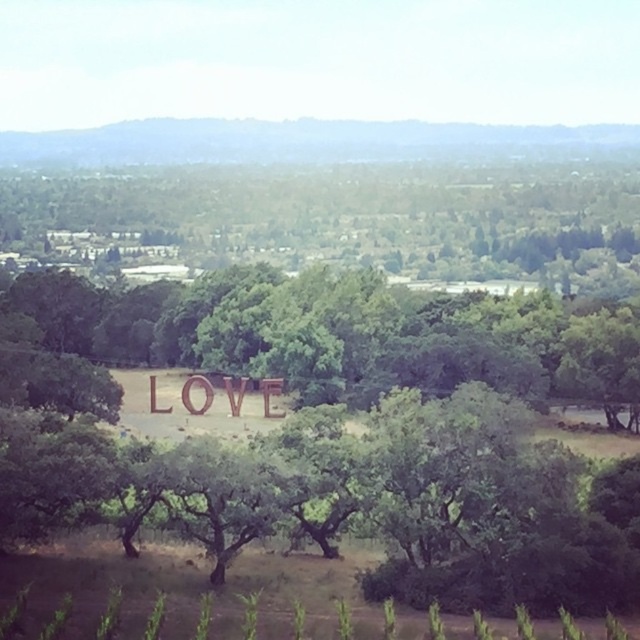
Can you confirm if green leafy tree at center is positioned to the left of wooden sign at center?

Incorrect, green leafy tree at center is not on the left side of wooden sign at center.

Between green leafy tree at center and wooden sign at center, which one has less height?

Standing shorter between the two is wooden sign at center.

Is point (205, 296) behind point (268, 406)?

Yes, it is behind point (268, 406).

Where is `green leafy tree at center`? The width and height of the screenshot is (640, 640). green leafy tree at center is located at coordinates (344, 337).